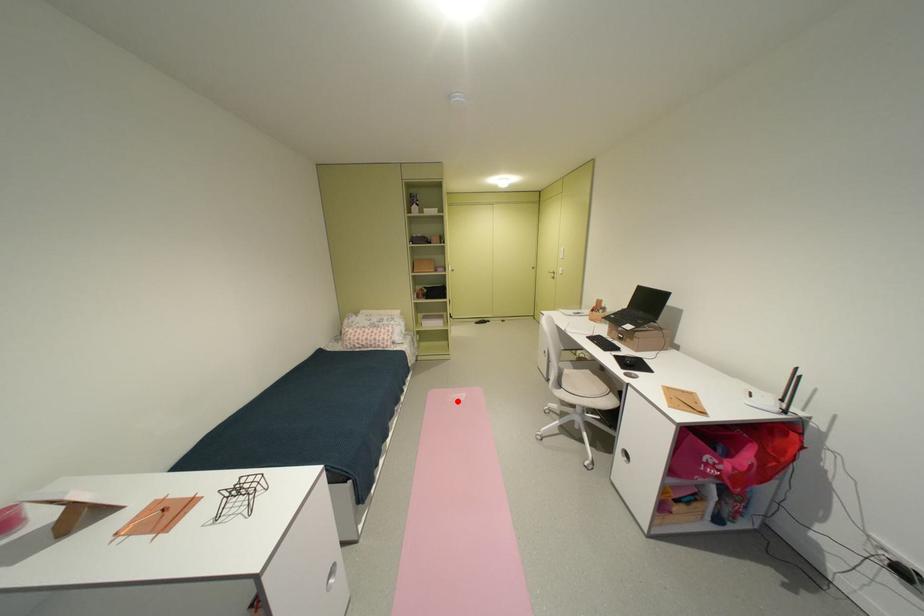
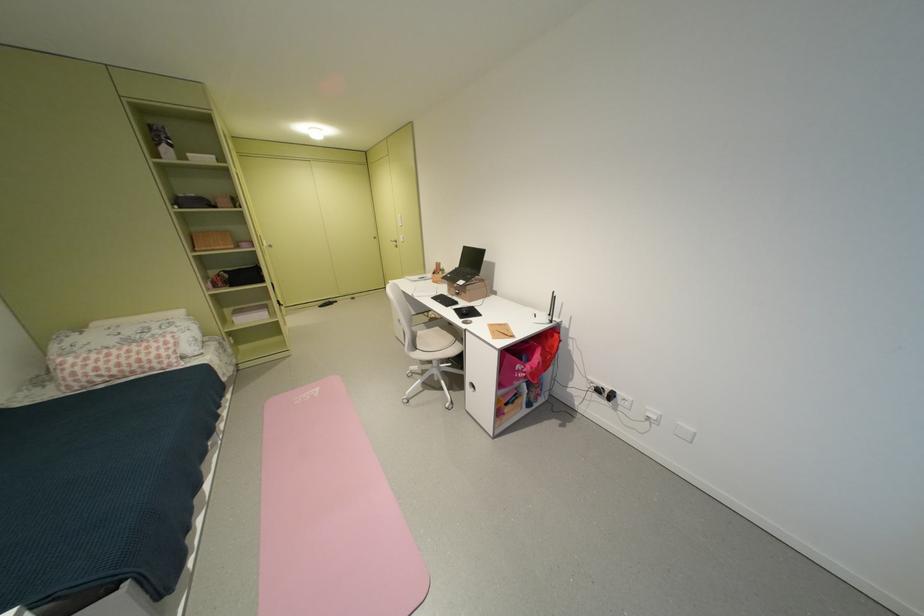
Find the pixel in the second image that matches the highlighted location in the first image.

(305, 403)